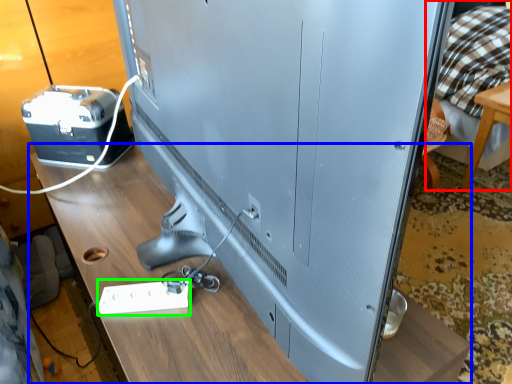
Question: Based on their relative distances, which object is nearer to bed (highlighted by a red box)? Choose from table (highlighted by a blue box) and extension cord (highlighted by a green box).

Choices:
 (A) table
 (B) extension cord

Answer: (A)